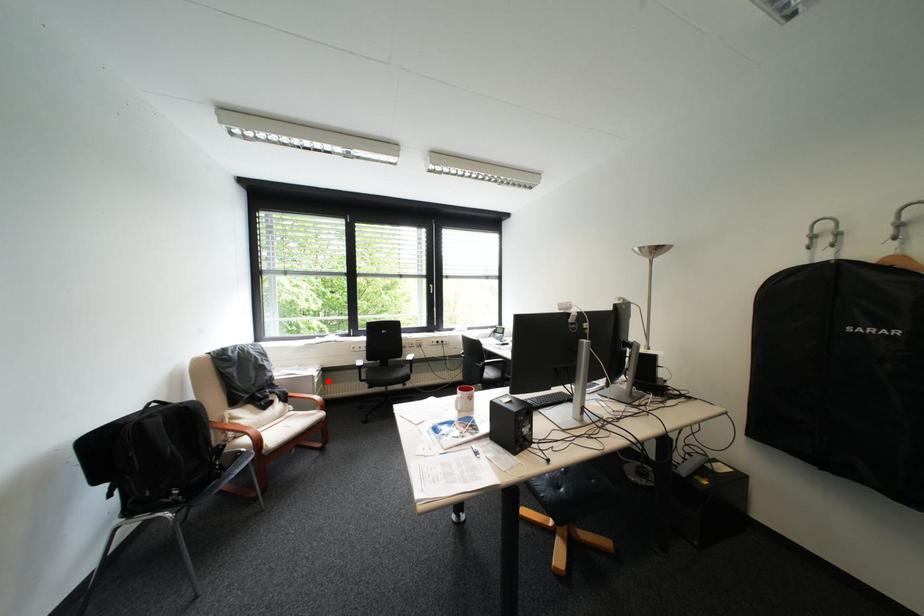
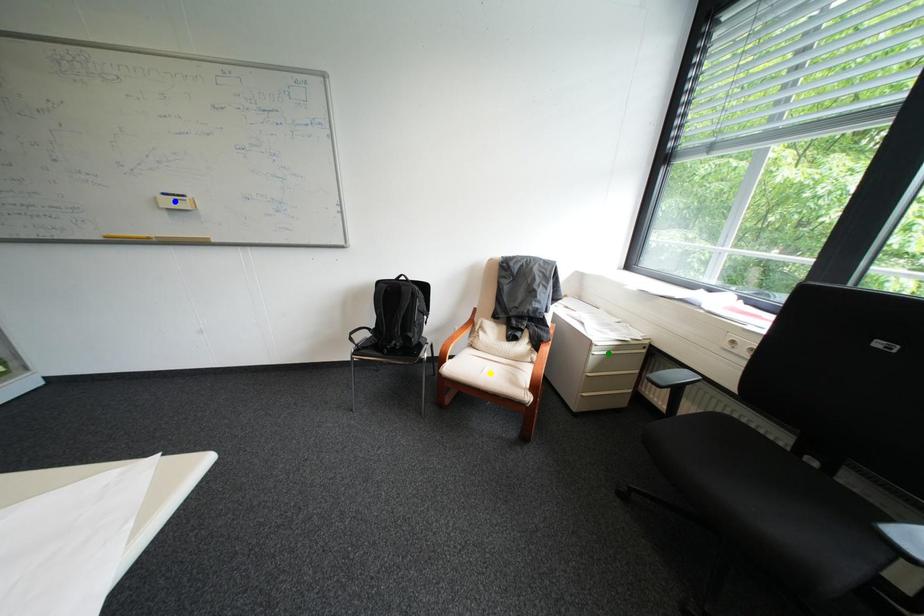
Question: I am providing you with two images of the same scene from different viewpoints. A red point is marked on the first image. You are given multiple points on the second image. Which point in image 2 is actually the same real-world point as the red point in image 1?

Choices:
 (A) green point
 (B) yellow point
 (C) blue point

Answer: (A)